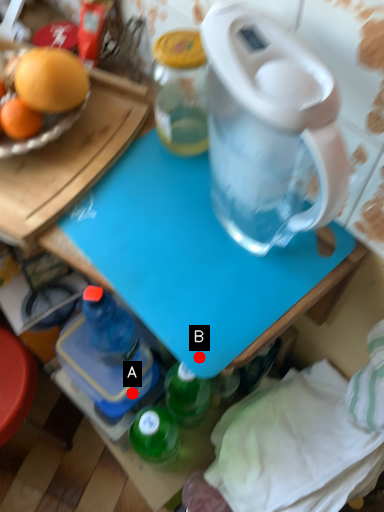
Question: Two points are circled on the image, labeled by A and B beside each circle. Among these points, which one is farthest from the camera?

Choices:
 (A) A is further
 (B) B is further

Answer: (A)